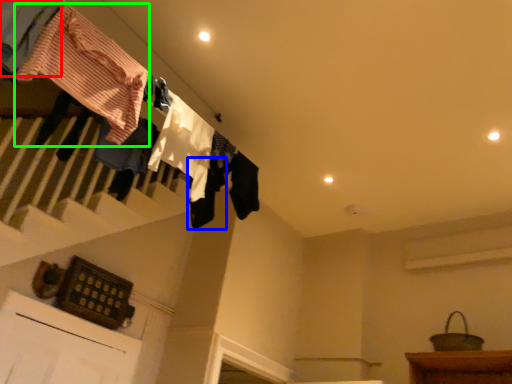
Question: Which is farther away from clothing (highlighted by a red box)? clothing (highlighted by a blue box) or clothing (highlighted by a green box)?

Choices:
 (A) clothing
 (B) clothing

Answer: (A)